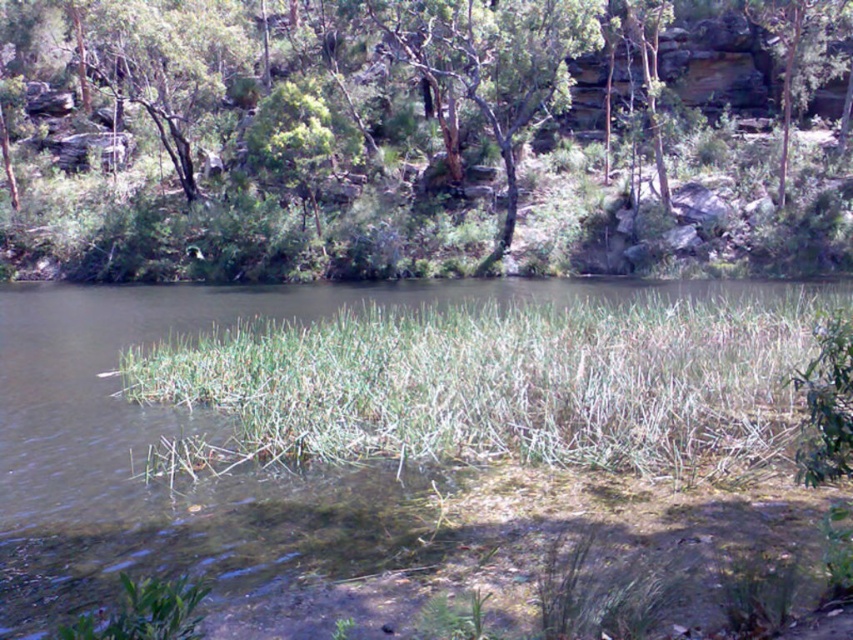
Which is below, green leafy tree at upper center or green leafy tree at upper right?

green leafy tree at upper right

Which is more to the right, green leafy tree at upper center or green leafy tree at upper right?

green leafy tree at upper right

Between point (123, 200) and point (776, 189), which one is positioned behind?

Positioned behind is point (123, 200).

This screenshot has width=853, height=640. What are the coordinates of `green leafy tree at upper center` in the screenshot? It's located at click(409, 140).

Who is lower down, green fibrous grass at center or green leafy tree at upper right?

green fibrous grass at center

Looking at this image, does green fibrous grass at center have a greater height compared to green leafy tree at upper right?

No, green fibrous grass at center is not taller than green leafy tree at upper right.

This screenshot has width=853, height=640. Find the location of `green fibrous grass at center`. green fibrous grass at center is located at coordinates (505, 384).

The width and height of the screenshot is (853, 640). What are the coordinates of `green fibrous grass at center` in the screenshot? It's located at [505, 384].

Between green leafy tree at upper center and green fibrous grass at center, which one is positioned lower?

Positioned lower is green fibrous grass at center.

Between green leafy tree at upper center and green fibrous grass at center, which one has less height?

green fibrous grass at center is shorter.

This screenshot has height=640, width=853. Describe the element at coordinates (409, 140) in the screenshot. I see `green leafy tree at upper center` at that location.

Locate an element on the screen. The height and width of the screenshot is (640, 853). green leafy tree at upper center is located at coordinates (409, 140).